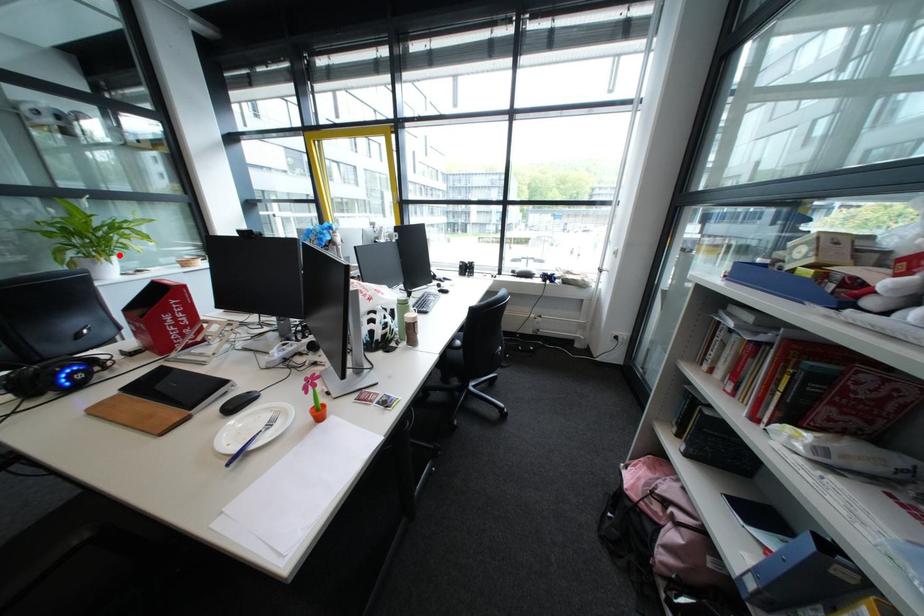
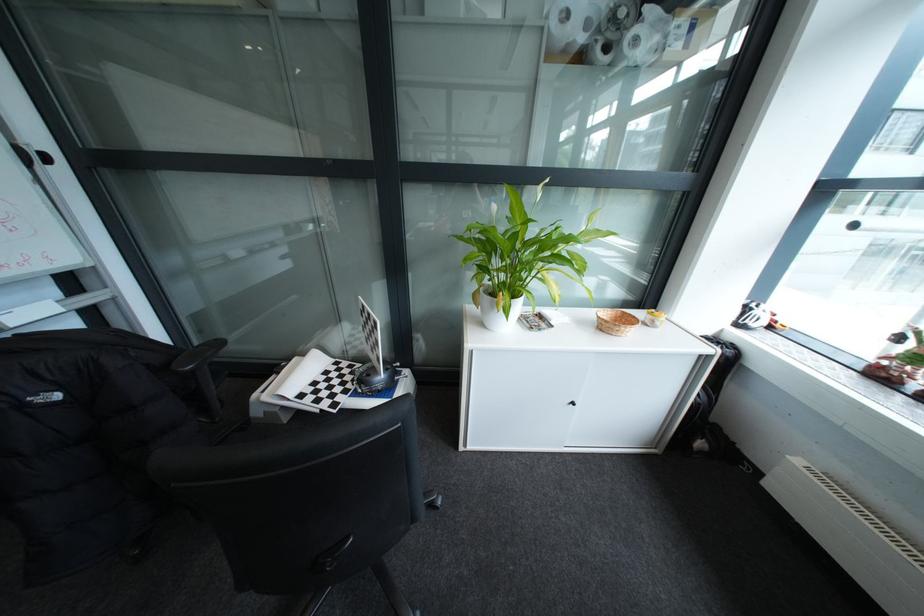
Find the pixel in the second image that matches the highlighted location in the first image.

(521, 299)